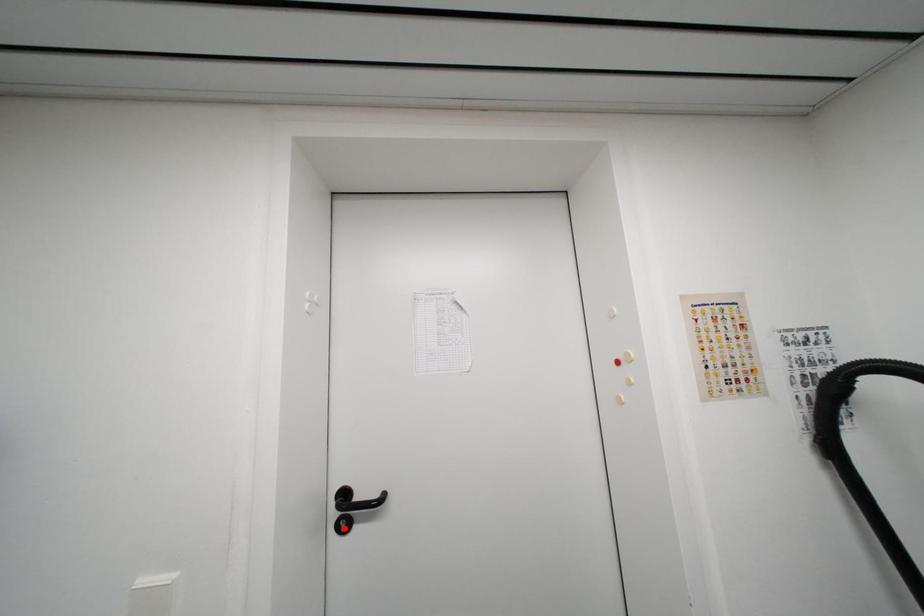
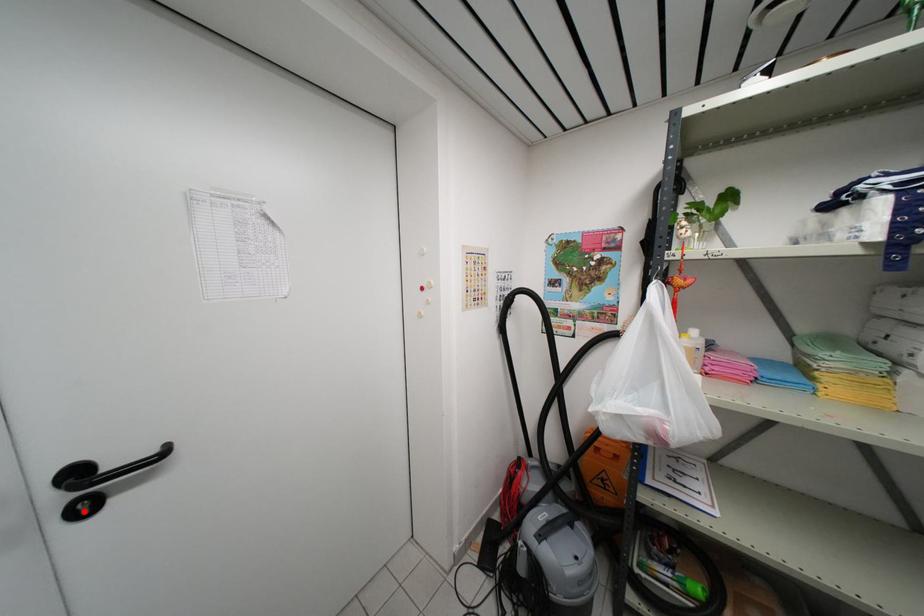
I am providing you with two images of the same scene from different viewpoints. A red point is marked on the first image and another point is marked on the second image. Is the marked point in image1 the same physical position as the marked point in image2?

Yes